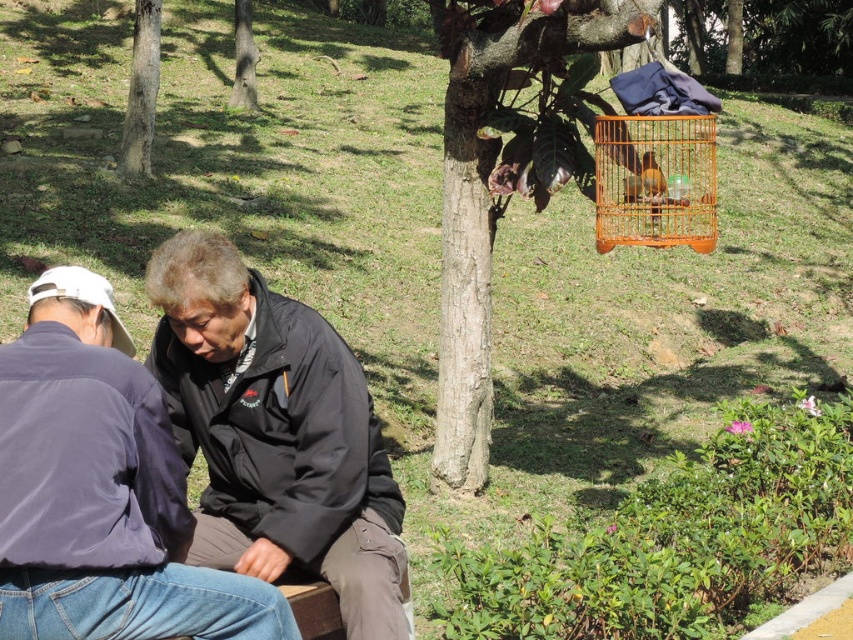
Which is behind, point (193, 308) or point (247, 84)?

Positioned behind is point (247, 84).

Is black matte jacket at center to the right of brown rough tree trunk at upper center from the viewer's perspective?

Yes, black matte jacket at center is to the right of brown rough tree trunk at upper center.

The image size is (853, 640). What are the coordinates of `black matte jacket at center` in the screenshot? It's located at (276, 435).

Identify the location of dark blue jacket at lower left. Image resolution: width=853 pixels, height=640 pixels. (102, 490).

Is dark blue jacket at lower left bigger than brown rough tree trunk at upper center?

Incorrect, dark blue jacket at lower left is not larger than brown rough tree trunk at upper center.

Is point (112, 440) more distant than point (236, 102)?

No, (112, 440) is closer to viewer.

At what (x,y) coordinates should I click in order to perform the action: click on dark blue jacket at lower left. Please return your answer as a coordinate pair (x, y). The image size is (853, 640). Looking at the image, I should click on (102, 490).

Is black matte jacket at center above dark blue jacket at lower left?

No, black matte jacket at center is not above dark blue jacket at lower left.

Between black matte jacket at center and dark blue jacket at lower left, which one is positioned higher?

Positioned higher is dark blue jacket at lower left.

Does point (154, 352) come in front of point (196, 579)?

No, it is behind (196, 579).

You are a GUI agent. You are given a task and a screenshot of the screen. Output one action in this format:
    pyautogui.click(x=<x>, y=<y>)
    Task: Click on the black matte jacket at center
    
    Given the screenshot: What is the action you would take?
    pyautogui.click(x=276, y=435)